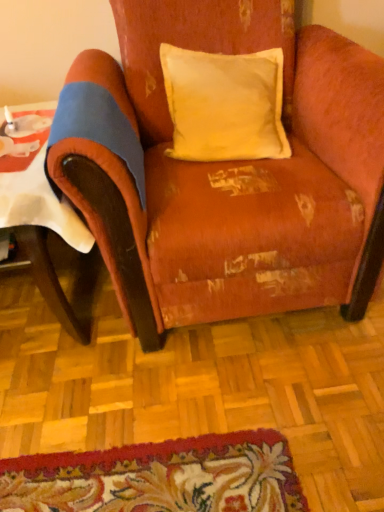
You are a GUI agent. You are given a task and a screenshot of the screen. Output one action in this format:
    pyautogui.click(x=<x>, y=<y>)
    Task: Click on the free space in front of worn velvet armchair at center
    
    Given the screenshot: What is the action you would take?
    pyautogui.click(x=218, y=425)